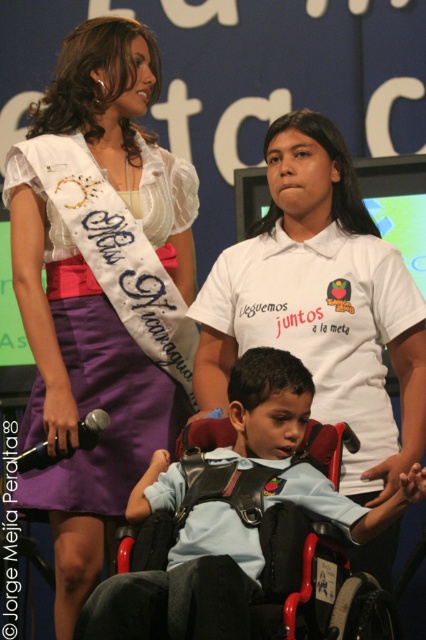
Question: Which object is positioned closest to the purple satin sash at upper center?

Choices:
 (A) light blue fabric shirt at center
 (B) white cotton shirt at center

Answer: (B)

Question: Does white cotton shirt at center have a lesser width compared to purple satin sash at upper center?

Choices:
 (A) no
 (B) yes

Answer: (A)

Question: Which object appears closest to the camera in this image?

Choices:
 (A) white cotton shirt at center
 (B) purple satin sash at upper center

Answer: (A)

Question: From the image, what is the correct spatial relationship of white cotton shirt at center in relation to light blue fabric shirt at center?

Choices:
 (A) right
 (B) left

Answer: (A)

Question: Among these points, which one is nearest to the camera?

Choices:
 (A) (75, 192)
 (B) (238, 570)
 (C) (370, 564)

Answer: (B)

Question: Can you confirm if white cotton shirt at center is positioned below light blue fabric shirt at center?

Choices:
 (A) no
 (B) yes

Answer: (A)